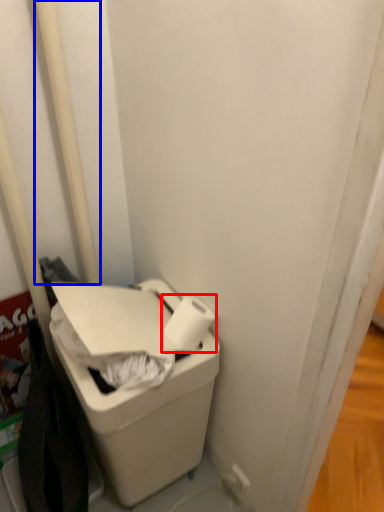
Question: Which object appears closest to the camera in this image, toilet paper (highlighted by a red box) or pole (highlighted by a blue box)?

Choices:
 (A) toilet paper
 (B) pole

Answer: (B)